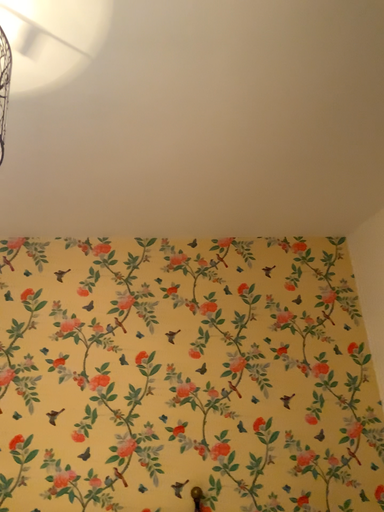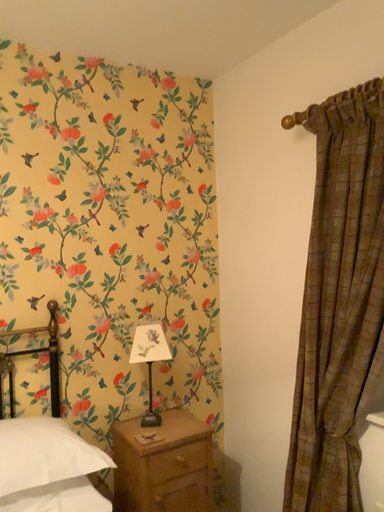
Question: Which way did the camera rotate in the video?

Choices:
 (A) rotated upward
 (B) rotated downward

Answer: (B)